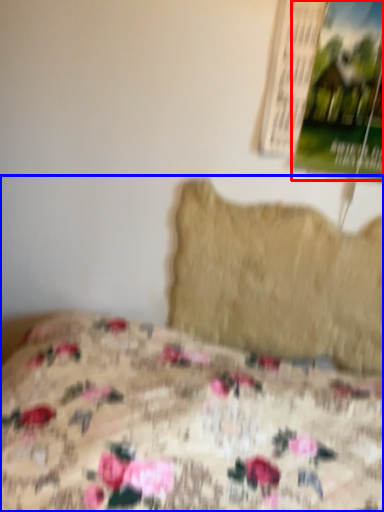
Question: Which point is further to the camera, poster page (highlighted by a red box) or bed (highlighted by a blue box)?

Choices:
 (A) poster page
 (B) bed

Answer: (A)